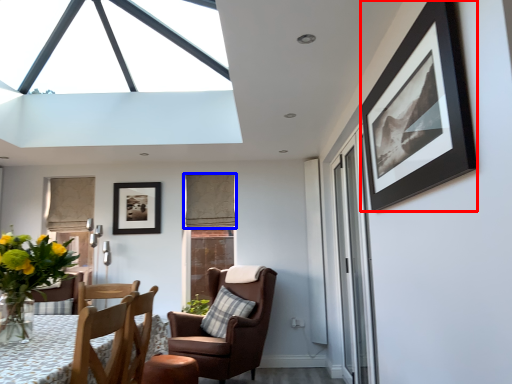
Question: Which point is further to the camera, picture frame (highlighted by a red box) or curtain (highlighted by a blue box)?

Choices:
 (A) picture frame
 (B) curtain

Answer: (B)